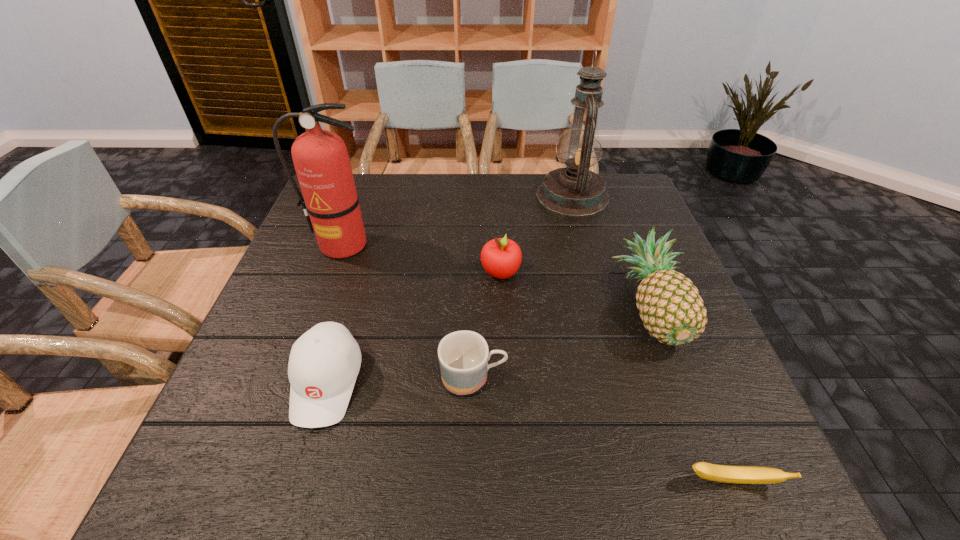
Where is `free space that satisfies the following two spatial constraints: 1. on the side of the pineapple with the nozzle and handle; 2. on the right side of the fire extinguisher`? Image resolution: width=960 pixels, height=540 pixels. free space that satisfies the following two spatial constraints: 1. on the side of the pineapple with the nozzle and handle; 2. on the right side of the fire extinguisher is located at coordinates (320, 307).

Identify the location of blank space that satisfies the following two spatial constraints: 1. on the side with the handle of the mug; 2. on the front-facing side of the baseball cap. (473, 383).

Where is `vacant area in the image that satisfies the following two spatial constraints: 1. on the side of the fire extinguisher with the nozzle and handle; 2. on the left side of the apple`? Image resolution: width=960 pixels, height=540 pixels. vacant area in the image that satisfies the following two spatial constraints: 1. on the side of the fire extinguisher with the nozzle and handle; 2. on the left side of the apple is located at coordinates (332, 273).